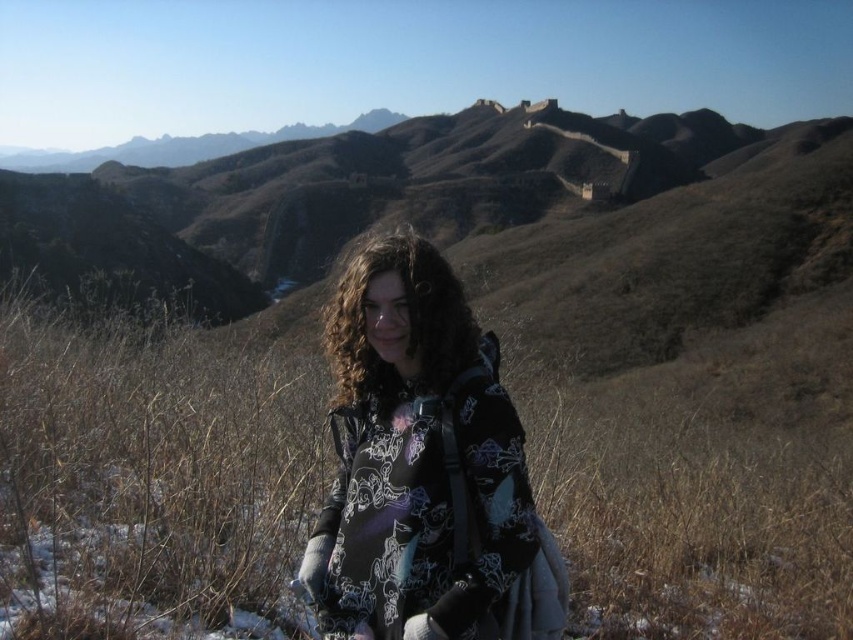
Who is positioned more to the right, brown dry grass at center or black printed hoodie at center?

Positioned to the right is brown dry grass at center.

Is brown dry grass at center above black printed hoodie at center?

Correct, brown dry grass at center is located above black printed hoodie at center.

Does point (73, 324) come in front of point (474, 340)?

No, it is behind (474, 340).

Find the location of a particular element. The height and width of the screenshot is (640, 853). brown dry grass at center is located at coordinates (152, 480).